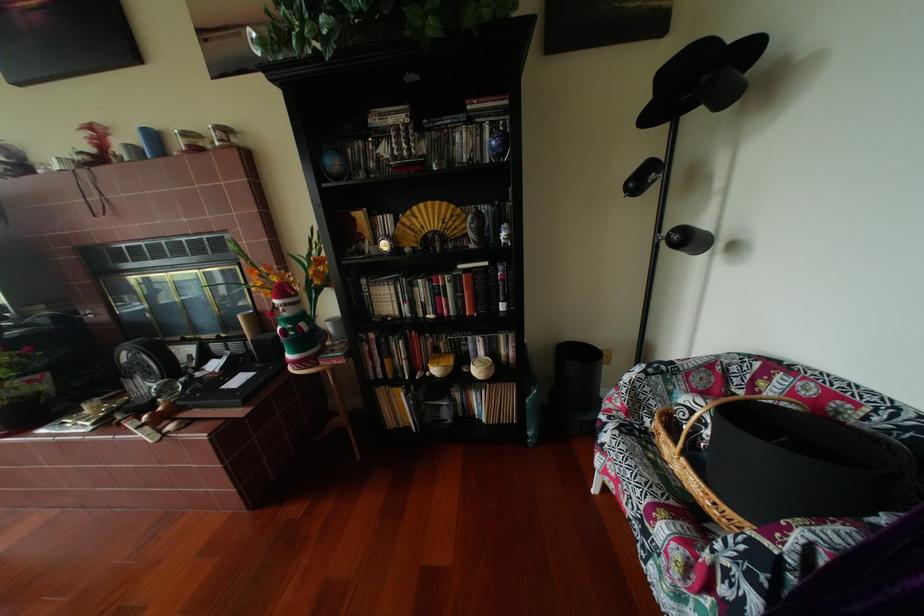
Image resolution: width=924 pixels, height=616 pixels. What do you see at coordinates (87, 313) in the screenshot? I see `the brass screen handle` at bounding box center [87, 313].